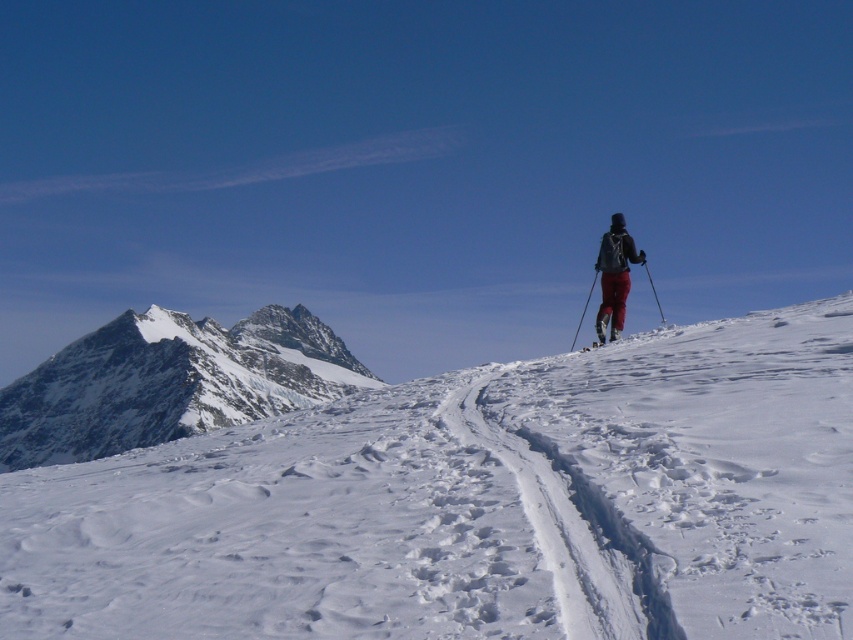
Question: Based on their relative distances, which object is farther from the matte black ski at upper right?

Choices:
 (A) black plastic ski pole at right
 (B) matte black ski at right
 (C) white powdery snow at center
 (D) matte black ski pole at right

Answer: (A)

Question: Is matte black ski pole at right in front of matte black ski at right?

Choices:
 (A) no
 (B) yes

Answer: (A)

Question: Can you confirm if white snow-covered mountain at upper left is positioned above red fabric pants at right?

Choices:
 (A) yes
 (B) no

Answer: (B)

Question: Is white snow-covered mountain at upper left wider than matte black ski at right?

Choices:
 (A) no
 (B) yes

Answer: (B)

Question: Which object appears farthest from the camera in this image?

Choices:
 (A) black plastic ski pole at right
 (B) matte black ski at upper right
 (C) matte black ski at right
 (D) white snow-covered mountain at upper left

Answer: (D)

Question: Which object is positioned farthest from the red fabric pants at right?

Choices:
 (A) black plastic ski pole at right
 (B) white snow-covered mountain at upper left

Answer: (A)